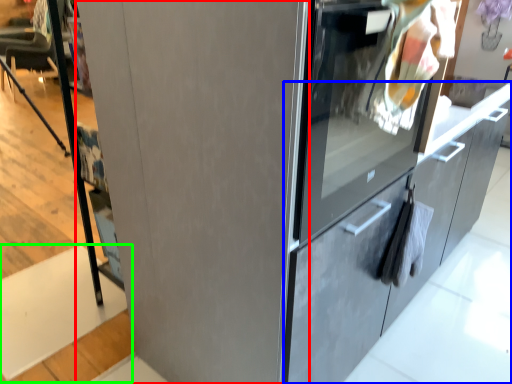
Question: Which is farther away from door (highlighted by a red box)? cabinetry (highlighted by a blue box) or stair (highlighted by a green box)?

Choices:
 (A) cabinetry
 (B) stair

Answer: (B)